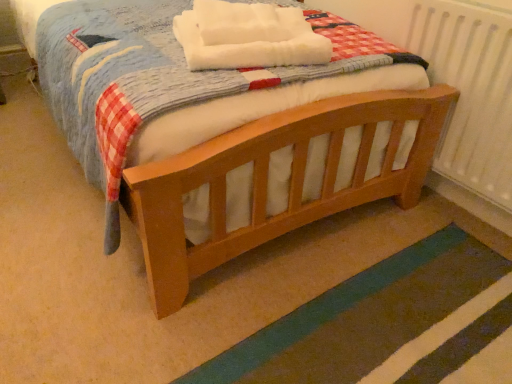
The height and width of the screenshot is (384, 512). I want to click on free space that is to the left of teal rug at lower right, so click(145, 301).